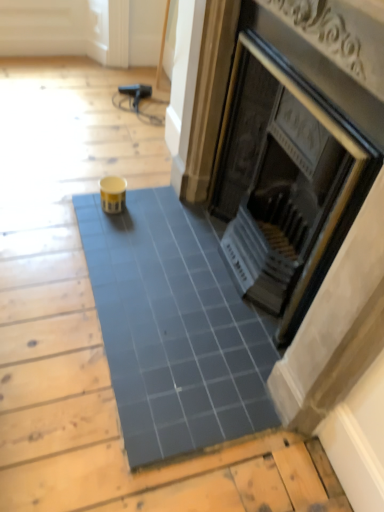
Where is `vacant area on top of blue glossy tile at center (from a real-world perspective)`? vacant area on top of blue glossy tile at center (from a real-world perspective) is located at coordinates (180, 308).